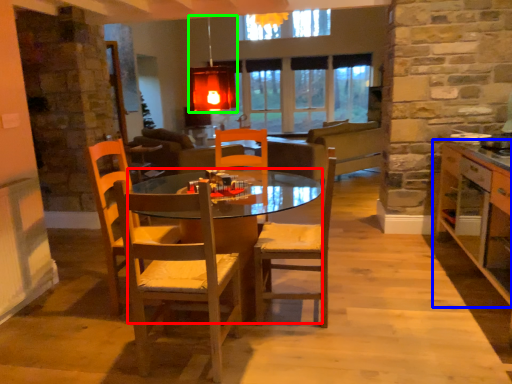
Question: Based on their relative distances, which object is farther from desk (highlighted by a red box)? Choose from cabinetry (highlighted by a blue box) and light fixture (highlighted by a green box).

Choices:
 (A) cabinetry
 (B) light fixture

Answer: (B)